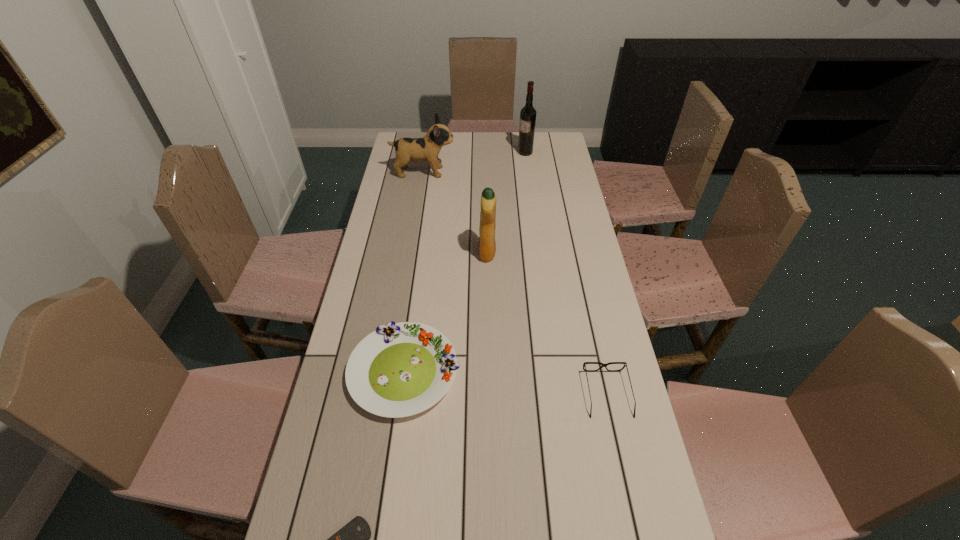
Identify the location of vacant region located on the label of the fourth object from left to right. This screenshot has height=540, width=960. (372, 253).

Find the location of a particular element. The height and width of the screenshot is (540, 960). vacant space positioned on the label of the fourth object from left to right is located at coordinates (417, 253).

Identify the location of free space located 0.160m on the label of the fourth object from left to right. (433, 253).

Image resolution: width=960 pixels, height=540 pixels. Identify the location of vacant region located 0.070m at the face of the puppy. (471, 172).

Find the location of a particular element. vacant region located 0.190m with the lenses facing outward on the rightmost object is located at coordinates (630, 498).

Find the location of a particular element. The height and width of the screenshot is (540, 960). vacant space situated on the right of the salad plate is located at coordinates (529, 372).

The width and height of the screenshot is (960, 540). Find the location of `object present at the far edge`. object present at the far edge is located at coordinates (528, 113).

You are a GUI agent. You are given a task and a screenshot of the screen. Output one action in this format:
    pyautogui.click(x=<x>, y=<y>)
    Task: Click on the puppy positioned at the left edge
    Image resolution: width=960 pixels, height=540 pixels.
    Given the screenshot: What is the action you would take?
    pyautogui.click(x=427, y=148)

Identify the location of salad plate positioned at the left edge. (401, 369).

What are the coordinates of `wine bottle located in the right edge section of the desktop` in the screenshot? It's located at (528, 113).